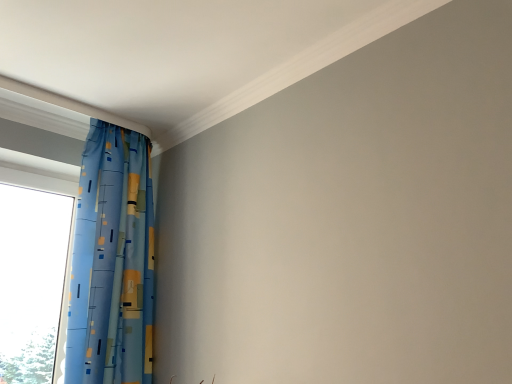
Describe the element at coordinates (112, 261) in the screenshot. I see `blue printed fabric curtain at left` at that location.

This screenshot has width=512, height=384. What are the coordinates of `blue printed fabric curtain at left` in the screenshot? It's located at click(x=112, y=261).

This screenshot has height=384, width=512. I want to click on transparent glass window at left, so click(x=31, y=281).

What do you see at coordinates (31, 281) in the screenshot?
I see `transparent glass window at left` at bounding box center [31, 281].

Image resolution: width=512 pixels, height=384 pixels. I want to click on blue printed fabric curtain at left, so click(x=112, y=261).

Consider the image. In the image, is transparent glass window at left on the left side or the right side of blue printed fabric curtain at left?

In the image, transparent glass window at left appears on the left side of blue printed fabric curtain at left.

Which object is further away from the camera taking this photo, transparent glass window at left or blue printed fabric curtain at left?

transparent glass window at left.

Which is in front, point (56, 313) or point (108, 143)?

The point (108, 143) is closer.

From the image's perspective, which is above, transparent glass window at left or blue printed fabric curtain at left?

From the image's view, blue printed fabric curtain at left is above.

From a real-world perspective, who is located lower, transparent glass window at left or blue printed fabric curtain at left?

transparent glass window at left is physically lower.

Is transparent glass window at left thinner than blue printed fabric curtain at left?

Correct, the width of transparent glass window at left is less than that of blue printed fabric curtain at left.

Considering the relative sizes of transparent glass window at left and blue printed fabric curtain at left in the image provided, is transparent glass window at left shorter than blue printed fabric curtain at left?

Correct, transparent glass window at left is not as tall as blue printed fabric curtain at left.

Does transparent glass window at left have a larger size compared to blue printed fabric curtain at left?

Incorrect, transparent glass window at left is not larger than blue printed fabric curtain at left.

Would you say blue printed fabric curtain at left is part of transparent glass window at left's contents?

No, blue printed fabric curtain at left is not surrounded by transparent glass window at left.

Is transparent glass window at left touching blue printed fabric curtain at left?

No, transparent glass window at left is not with blue printed fabric curtain at left.

Is transparent glass window at left positioned with its back to blue printed fabric curtain at left?

No, transparent glass window at left's orientation is not away from blue printed fabric curtain at left.

How different are the orientations of transparent glass window at left and blue printed fabric curtain at left in degrees?

0.00235 degrees.

You are a GUI agent. You are given a task and a screenshot of the screen. Output one action in this format:
    pyautogui.click(x=<x>, y=<y>)
    Task: Click on the window lying behind the blue printed fabric curtain at left
    The image size is (512, 384).
    Given the screenshot: What is the action you would take?
    pyautogui.click(x=31, y=281)

Which is more to the right, blue printed fabric curtain at left or transparent glass window at left?

blue printed fabric curtain at left is more to the right.

Which object is closer to the camera, blue printed fabric curtain at left or transparent glass window at left?

blue printed fabric curtain at left is closer to the camera.

Which point is more forward, (98,325) or (0,244)?

The point (98,325) is more forward.

From the image's perspective, is blue printed fabric curtain at left positioned above or below transparent glass window at left?

blue printed fabric curtain at left is situated higher than transparent glass window at left in the image.

From a real-world perspective, is blue printed fabric curtain at left beneath transparent glass window at left?

Actually, blue printed fabric curtain at left is physically above transparent glass window at left in the real world.

Which object is thinner, blue printed fabric curtain at left or transparent glass window at left?

Thinner between the two is transparent glass window at left.

Does blue printed fabric curtain at left have a greater height compared to transparent glass window at left?

Yes, blue printed fabric curtain at left is taller than transparent glass window at left.

Does blue printed fabric curtain at left have a larger size compared to transparent glass window at left?

Correct, blue printed fabric curtain at left is larger in size than transparent glass window at left.

Is blue printed fabric curtain at left situated inside transparent glass window at left or outside?

blue printed fabric curtain at left is located beyond the bounds of transparent glass window at left.

Is blue printed fabric curtain at left not close to transparent glass window at left?

No, blue printed fabric curtain at left is not far from transparent glass window at left.

Is blue printed fabric curtain at left oriented towards transparent glass window at left?

No.

How different are the orientations of blue printed fabric curtain at left and transparent glass window at left in degrees?

0.00235 degrees.

What are the coordinates of `curtain lying above the transparent glass window at left (from the image's perspective)` in the screenshot? It's located at (112, 261).

This screenshot has height=384, width=512. In order to click on curtain above the transparent glass window at left (from a real-world perspective) in this screenshot , I will do `click(112, 261)`.

Locate an element on the screen. This screenshot has height=384, width=512. window below the blue printed fabric curtain at left (from the image's perspective) is located at coordinates (31, 281).